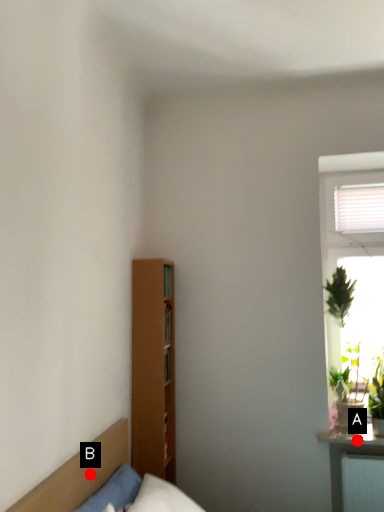
Question: Two points are circled on the image, labeled by A and B beside each circle. Among these points, which one is nearest to the camera?

Choices:
 (A) A is closer
 (B) B is closer

Answer: (B)